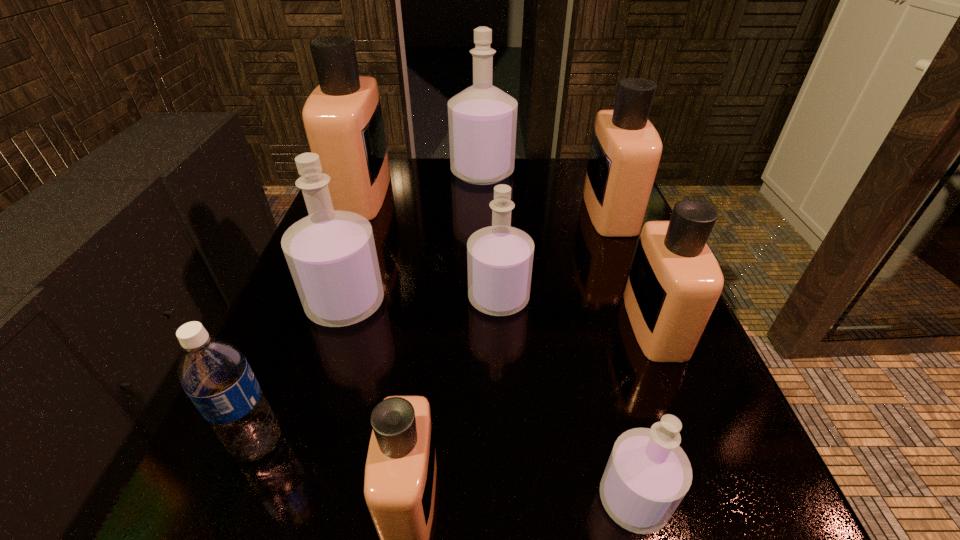
Where is `perfume that is the fifth closest to the water bottle`? The width and height of the screenshot is (960, 540). perfume that is the fifth closest to the water bottle is located at coordinates pos(342,117).

Locate an element on the screen. purple perfume that is the second closest to the nearest purple perfume is located at coordinates (331, 254).

Find the location of `the third closest purple perfume to the farthest purple perfume`. the third closest purple perfume to the farthest purple perfume is located at coordinates (648, 474).

This screenshot has height=540, width=960. Identify the location of beige perfume that stands as the third closest to the third smallest beige perfume. (400, 474).

Select which beige perfume appears as the second closest to the nearest purple perfume. Please provide its 2D coordinates. Your answer should be formatted as a tuple, i.e. [(x, y)], where the tuple contains the x and y coordinates of a point satisfying the conditions above.

[(400, 474)]

Where is `vacant region that satisfies the following two spatial constraints: 1. on the back side of the third biggest purple perfume; 2. on the left side of the water bottle`? The height and width of the screenshot is (540, 960). vacant region that satisfies the following two spatial constraints: 1. on the back side of the third biggest purple perfume; 2. on the left side of the water bottle is located at coordinates (317, 298).

The height and width of the screenshot is (540, 960). Identify the location of vacant region that satisfies the following two spatial constraints: 1. on the front side of the leftmost purple perfume; 2. on the left side of the nearest purple perfume. (282, 500).

You are a GUI agent. You are given a task and a screenshot of the screen. Output one action in this format:
    pyautogui.click(x=<x>, y=<y>)
    Task: Click on the vacant space that satisfies the following two spatial constraints: 1. on the front label of the third smallest beige perfume; 2. on the front side of the third biggest purple perfume
    
    Given the screenshot: What is the action you would take?
    pyautogui.click(x=645, y=298)

At what (x,y) coordinates should I click in order to perform the action: click on free point that satisfies the following two spatial constraints: 1. on the back side of the third smallest purple perfume; 2. on the front label of the leftmost beige perfume. Please return your answer as a coordinate pair (x, y). Looking at the image, I should click on (381, 194).

Where is `free space that satisfies the following two spatial constraints: 1. on the front label of the biggest beige perfume; 2. on the right side of the second biggest purple perfume`? This screenshot has width=960, height=540. free space that satisfies the following two spatial constraints: 1. on the front label of the biggest beige perfume; 2. on the right side of the second biggest purple perfume is located at coordinates (319, 303).